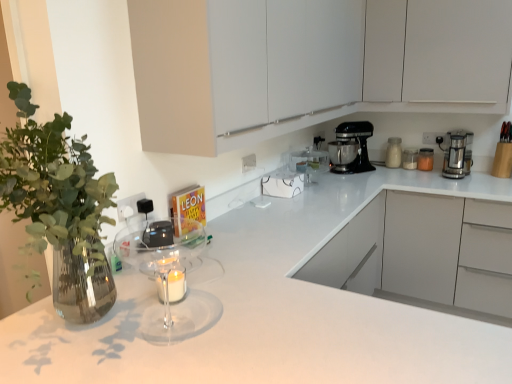
Question: Are white matte cabinet at upper center, the second cabinetry when ordered from back to front, and white glossy jar at upper right, which is the 2th kitchen appliance from left to right, beside each other?

Choices:
 (A) yes
 (B) no

Answer: (B)

Question: Can we say white matte cabinet at upper center, which is the first cabinetry in front-to-back order, lies outside white glossy jar at upper right, which is the 2th kitchen appliance from left to right?

Choices:
 (A) yes
 (B) no

Answer: (A)

Question: Can you confirm if white matte cabinet at upper center, which is the first cabinetry in front-to-back order, is wider than white glossy jar at upper right, the third kitchen appliance from the right?

Choices:
 (A) yes
 (B) no

Answer: (A)

Question: Is there a large distance between white matte cabinet at upper center, which is the first cabinetry in front-to-back order, and white glossy jar at upper right, which is the 2th kitchen appliance from left to right?

Choices:
 (A) no
 (B) yes

Answer: (B)

Question: Can you confirm if white matte cabinet at upper center, the second cabinetry when ordered from back to front, is thinner than white glossy jar at upper right, the third kitchen appliance from the right?

Choices:
 (A) yes
 (B) no

Answer: (B)

Question: Choose the correct answer: Is translucent glass jar at upper right, the second kitchen appliance in the right-to-left sequence, inside white glossy jar at upper right, the third kitchen appliance from the right, or outside it?

Choices:
 (A) outside
 (B) inside

Answer: (A)

Question: Is translucent glass jar at upper right, the second kitchen appliance in the right-to-left sequence, in front of or behind white glossy jar at upper right, which is the 2th kitchen appliance from left to right, in the image?

Choices:
 (A) front
 (B) behind

Answer: (A)

Question: Is translucent glass jar at upper right, the second kitchen appliance in the right-to-left sequence, to the left or to the right of white glossy jar at upper right, the third kitchen appliance from the right, in the image?

Choices:
 (A) left
 (B) right

Answer: (B)

Question: Is translucent glass jar at upper right, acting as the 3th kitchen appliance starting from the left, taller or shorter than white glossy jar at upper right, which is the 2th kitchen appliance from left to right?

Choices:
 (A) short
 (B) tall

Answer: (A)

Question: Relative to satin silver coffee maker at right, which ranks as the first kitchen appliance in right-to-left order, is white glossy countertop at center in front or behind?

Choices:
 (A) front
 (B) behind

Answer: (A)

Question: From the image's perspective, is white glossy countertop at center above or below satin silver coffee maker at right, which ranks as the first kitchen appliance in right-to-left order?

Choices:
 (A) above
 (B) below

Answer: (B)

Question: From a real-world perspective, is white glossy countertop at center physically located above or below satin silver coffee maker at right, which ranks as the first kitchen appliance in right-to-left order?

Choices:
 (A) above
 (B) below

Answer: (B)

Question: Is white glossy countertop at center spatially inside satin silver coffee maker at right, placed as the 4th kitchen appliance when sorted from left to right, or outside of it?

Choices:
 (A) outside
 (B) inside

Answer: (A)

Question: Does point (362, 150) appear closer or farther from the camera than point (418, 157)?

Choices:
 (A) farther
 (B) closer

Answer: (B)

Question: Do you think black metallic stand mixer at upper right, the 1th kitchen appliance when ordered from left to right, is within translucent glass jar at upper right, the second kitchen appliance in the right-to-left sequence, or outside of it?

Choices:
 (A) inside
 (B) outside

Answer: (B)